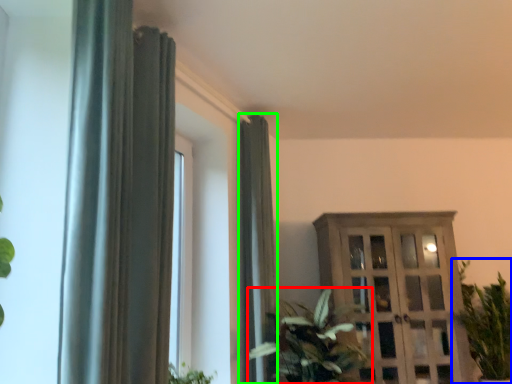
Question: Considering the real-world distances, which object is farthest from houseplant (highlighted by a red box)? houseplant (highlighted by a blue box) or curtain (highlighted by a green box)?

Choices:
 (A) houseplant
 (B) curtain

Answer: (A)